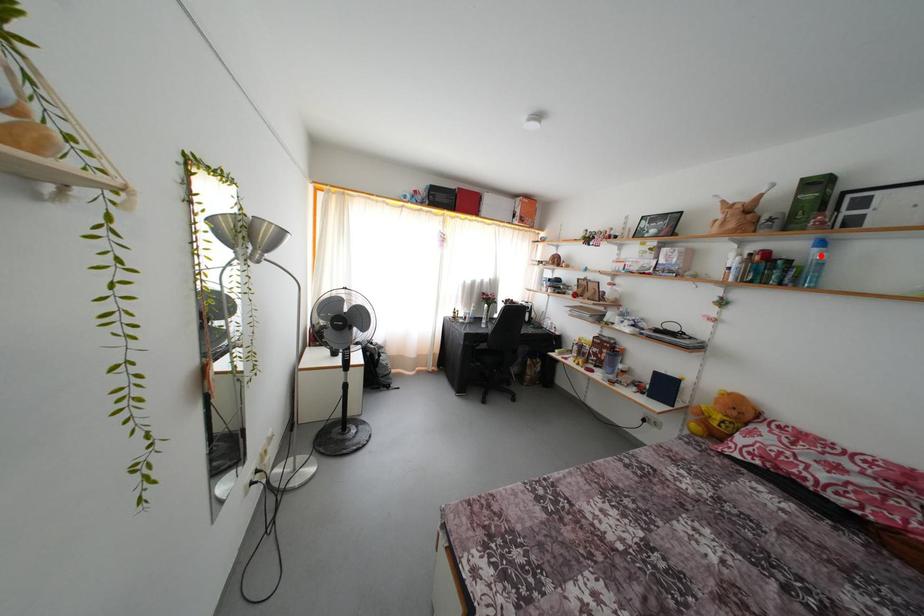
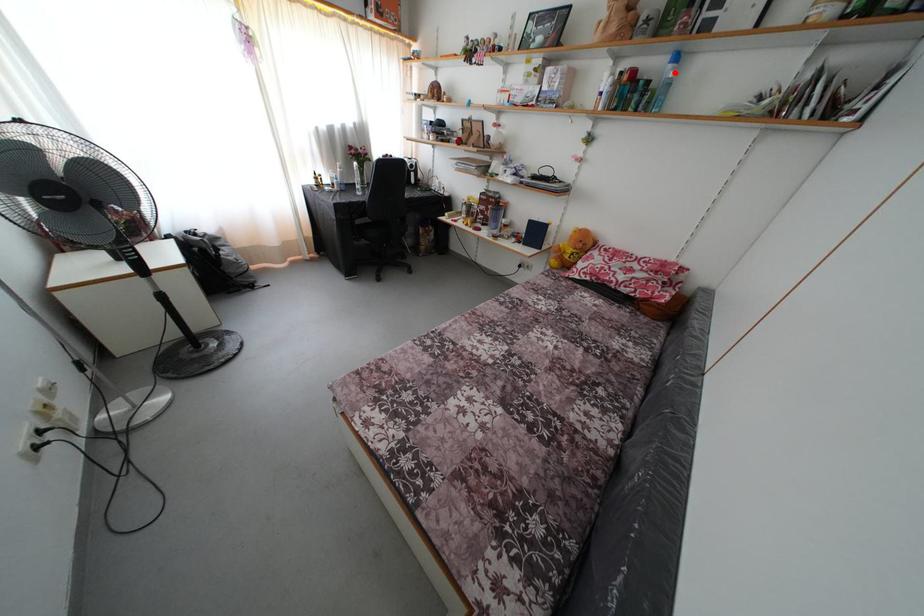
I am providing you with two images of the same scene from different viewpoints. A red point is marked on the first image and another point is marked on the second image. Is the red point in image1 aligned with the point shown in image2?

Yes